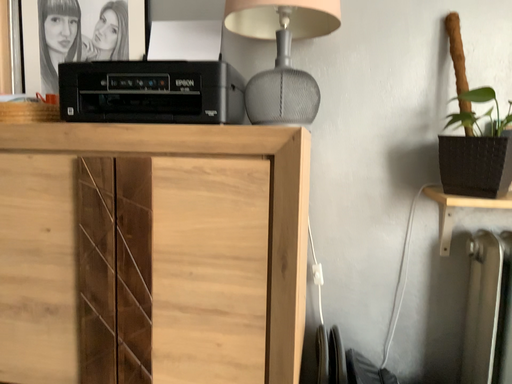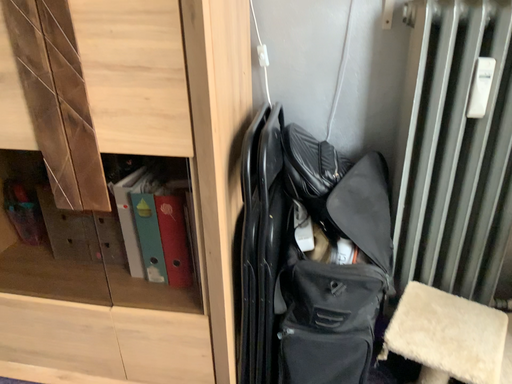
Question: Which way did the camera rotate in the video?

Choices:
 (A) rotated upward
 (B) rotated downward

Answer: (B)